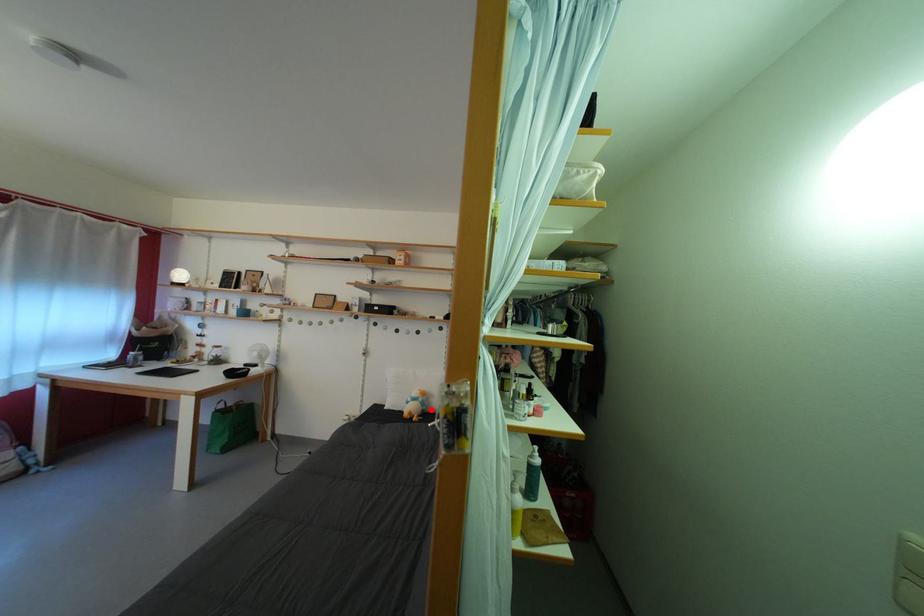
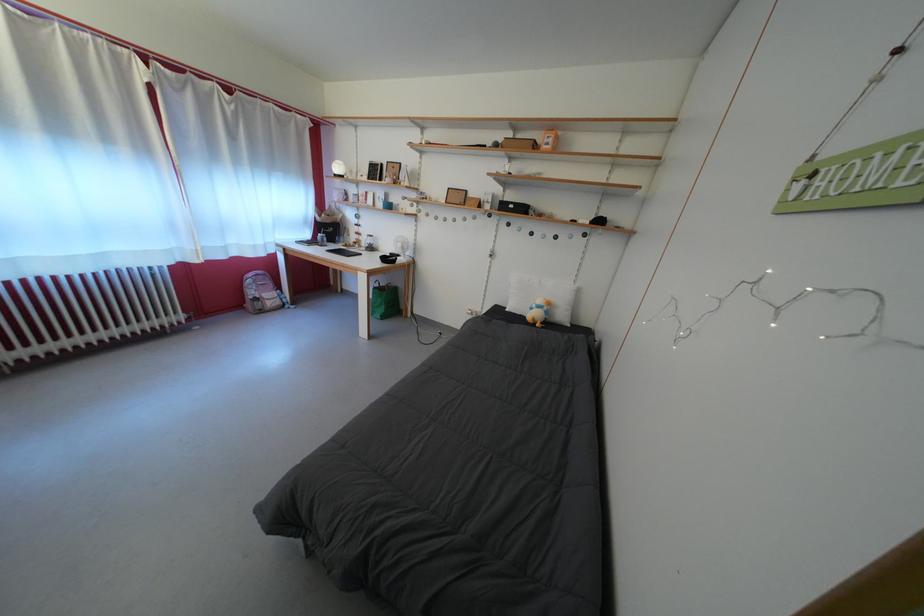
Question: I am providing you with two images of the same scene from different viewpoints. A red point is shown in image1. For the corresponding object point in image2, is it positioned nearer or farther from the camera?

Choices:
 (A) Nearer
 (B) Farther

Answer: (A)